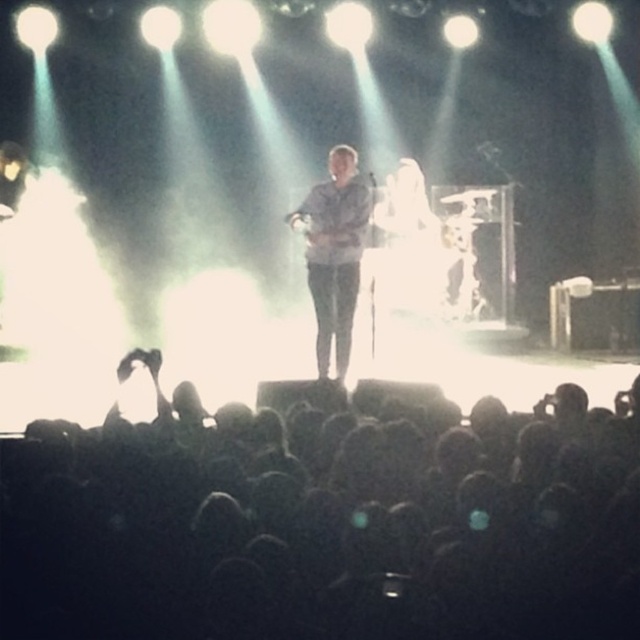
Can you confirm if black matte crowd at lower center is positioned to the right of light blue denim shirt at center?

Yes, black matte crowd at lower center is to the right of light blue denim shirt at center.

Does black matte crowd at lower center have a smaller size compared to light blue denim shirt at center?

No, black matte crowd at lower center is not smaller than light blue denim shirt at center.

This screenshot has height=640, width=640. I want to click on black matte crowd at lower center, so click(324, 518).